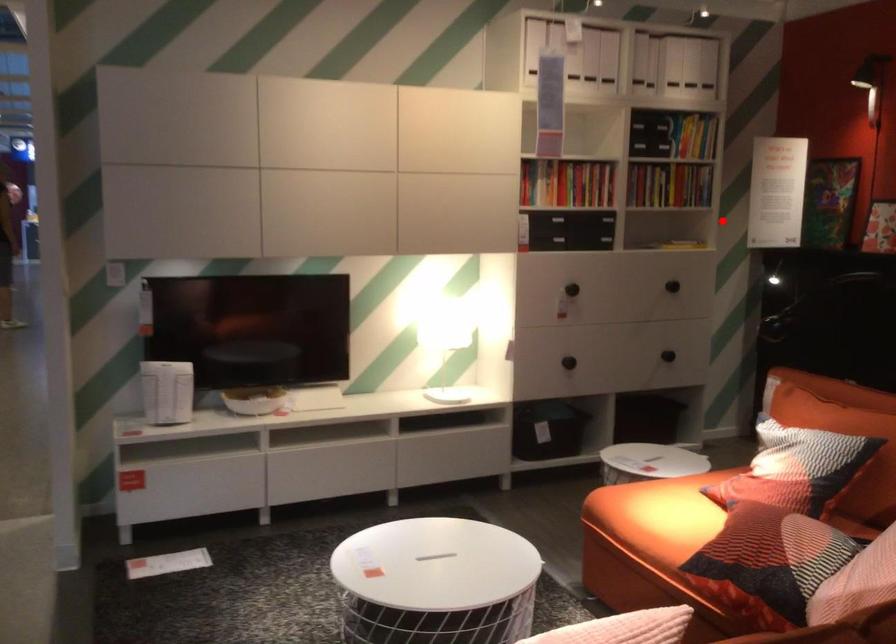
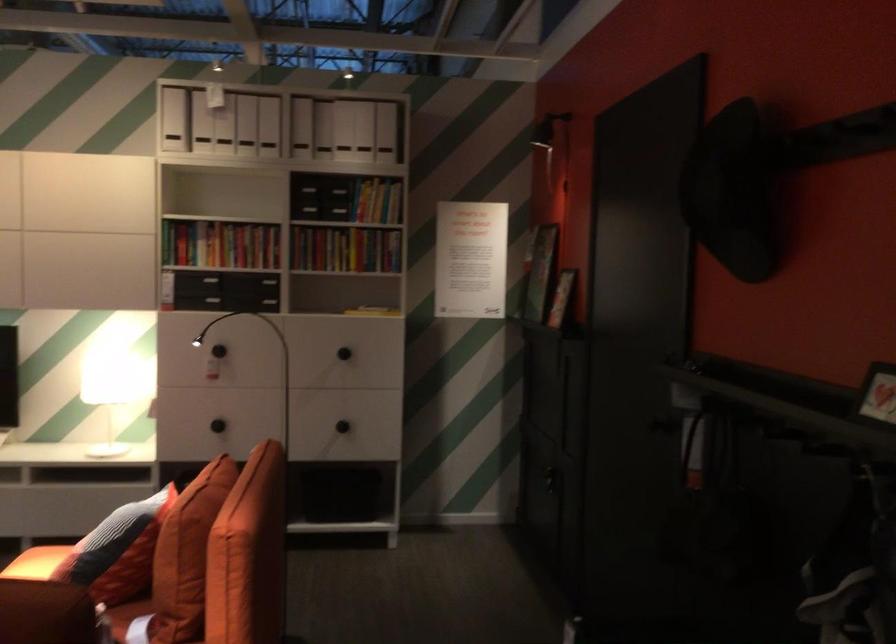
In the second image, find the point that corresponds to the highlighted location in the first image.

(372, 310)